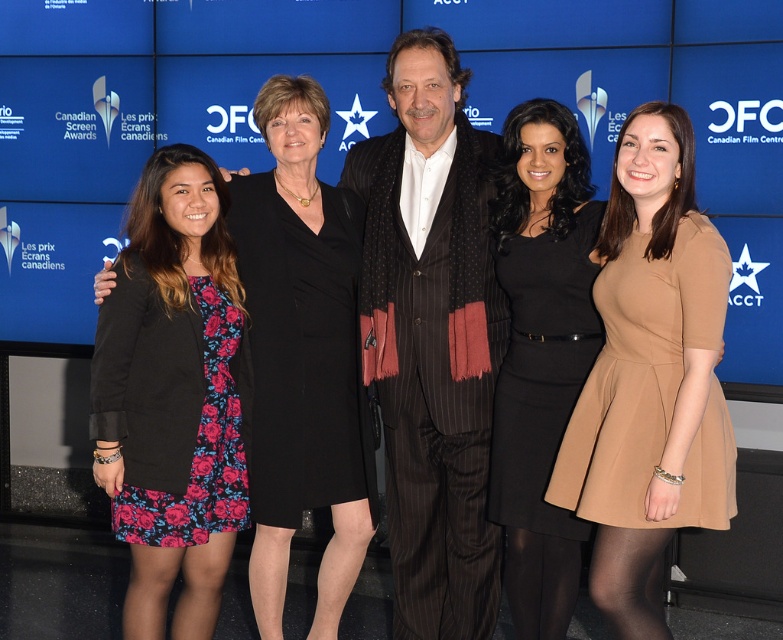
Between striped wool suit at center and floral dress at left, which one is positioned lower?

floral dress at left is below.

Who is more distant from viewer, (424, 580) or (240, 476)?

The point (424, 580) is behind.

I want to click on striped wool suit at center, so click(431, 339).

Which is behind, point (264, 508) or point (527, 621)?

Positioned behind is point (264, 508).

Image resolution: width=783 pixels, height=640 pixels. I want to click on floral dress at center, so click(302, 356).

Is point (258, 534) more distant than point (558, 209)?

Yes, point (258, 534) is farther from viewer.

Where is `floral dress at center`? This screenshot has height=640, width=783. floral dress at center is located at coordinates (302, 356).

Who is taller, matte beige dress at center or floral dress at left?

floral dress at left

In the scene shown: Can you confirm if matte beige dress at center is taller than floral dress at left?

In fact, matte beige dress at center may be shorter than floral dress at left.

Is point (659, 296) in front of point (143, 531)?

Yes, point (659, 296) is closer to viewer.

Where is `matte beige dress at center`? Image resolution: width=783 pixels, height=640 pixels. matte beige dress at center is located at coordinates (650, 378).